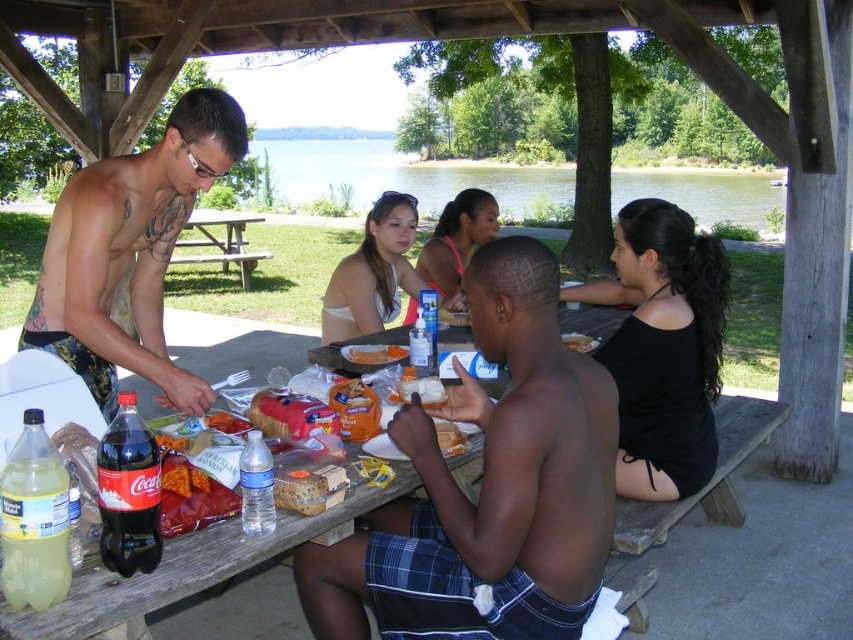
Is brown wooden picnic table at center wider than orange bread at center?

Yes.

Can you confirm if brown wooden picnic table at center is taller than orange bread at center?

Indeed, brown wooden picnic table at center has a greater height compared to orange bread at center.

Is point (183, 241) more distant than point (378, 355)?

Yes, point (183, 241) is behind point (378, 355).

The width and height of the screenshot is (853, 640). Identify the location of brown wooden picnic table at center. (222, 243).

Can you confirm if orange bread at center is shorter than smooth white bread at center?

Correct, orange bread at center is not as tall as smooth white bread at center.

Is orange bread at center taller than smooth white bread at center?

No, orange bread at center is not taller than smooth white bread at center.

Where is `orange bread at center`? This screenshot has width=853, height=640. orange bread at center is located at coordinates [374, 353].

Which of these two, shiny black shorts at left or green water at upper center, stands taller?

green water at upper center is taller.

Can you confirm if shiny black shorts at left is smaller than green water at upper center?

Correct, shiny black shorts at left occupies less space than green water at upper center.

Does point (173, 145) come farther from viewer compared to point (676, 195)?

That is False.

You are a GUI agent. You are given a task and a screenshot of the screen. Output one action in this format:
    pyautogui.click(x=<x>, y=<y>)
    Task: Click on the shiny black shorts at left
    
    Given the screenshot: What is the action you would take?
    pyautogui.click(x=131, y=252)